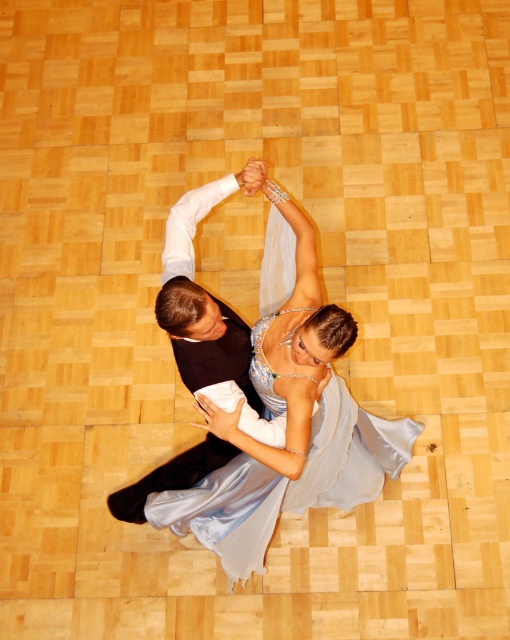
From the picture: You are a photographer setting up for a dance performance and need to ensure both the satin dress at center and the shiny black suit at center are fully visible in your shot. Given that the camera frame can only accommodate one of the two objects due to space constraints, which object should you prioritize to capture entirely?

The satin dress at center is larger in size than the shiny black suit at center, so you should prioritize capturing the satin dress at center entirely to ensure it fits within the camera frame.

You are a photographer setting up a camera to capture the dance scene. You need to ensure that both the satin dress at center and the shiny black suit at center are fully visible in the frame. Based on their sizes, which object might require more space in the camera frame?

The satin dress at center might be wider than the shiny black suit at center, so it might require more space in the camera frame to ensure it is fully visible.